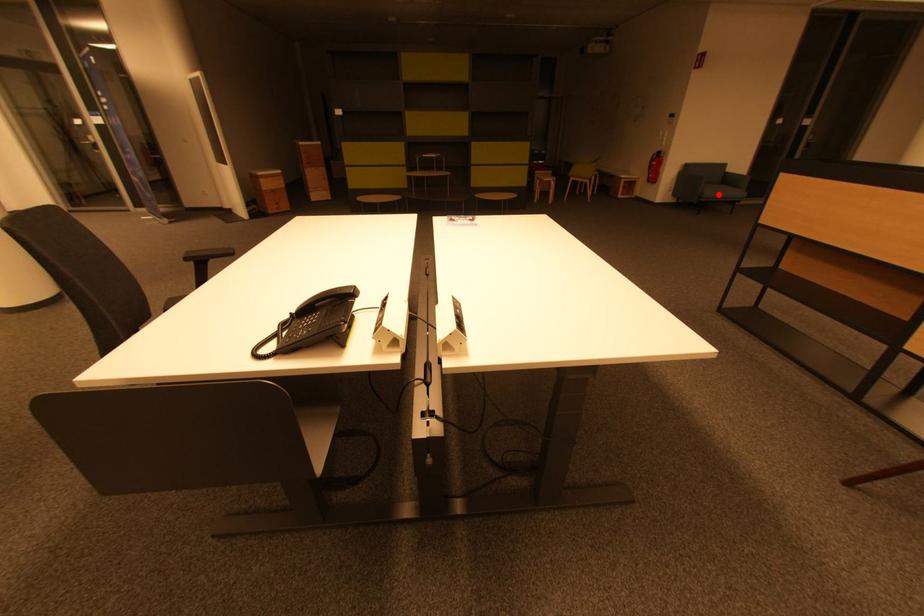
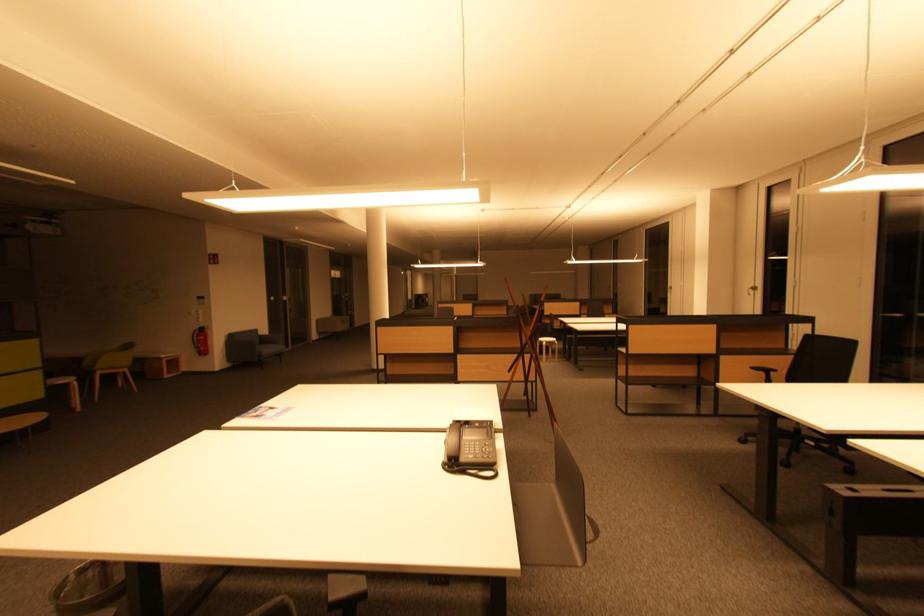
Question: I am providing you with two images of the same scene from different viewpoints. A red point is shown in image1. For the corresponding object point in image2, is it positioned nearer or farther from the camera?

Choices:
 (A) Nearer
 (B) Farther

Answer: (A)